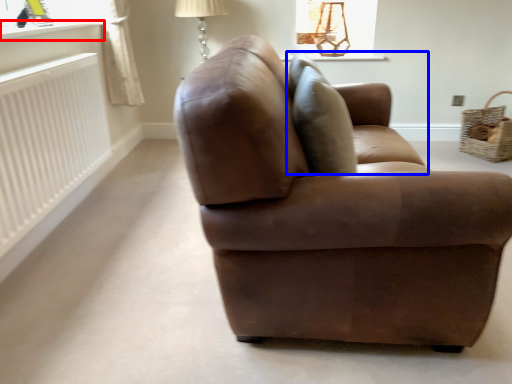
Question: Which of the following is the closest to the observer, window sill (highlighted by a red box) or swivel chair (highlighted by a blue box)?

Choices:
 (A) window sill
 (B) swivel chair

Answer: (B)